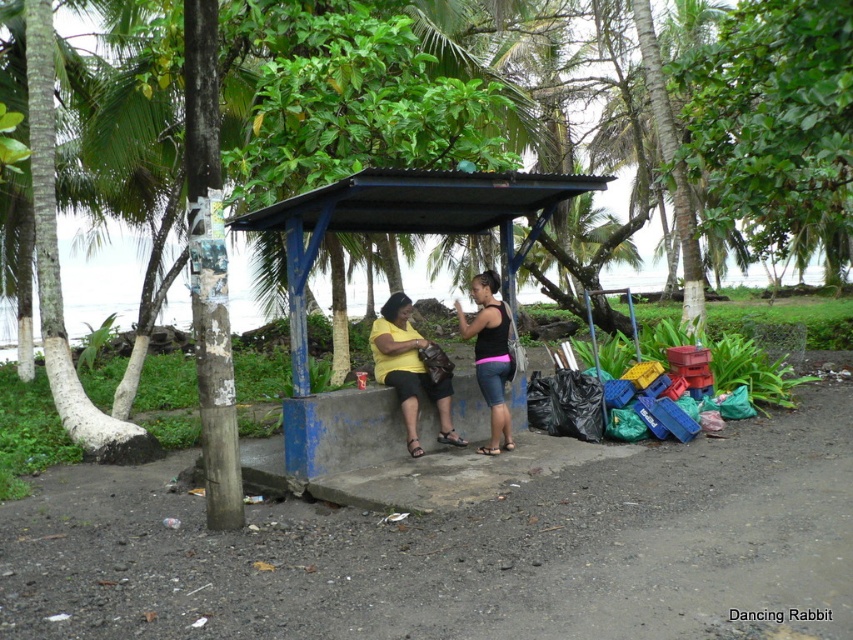
Can you confirm if white bark tree at center is positioned above blue painted wood bus stop at center?

Correct, white bark tree at center is located above blue painted wood bus stop at center.

Who is positioned more to the right, white bark tree at center or blue painted wood bus stop at center?

From the viewer's perspective, white bark tree at center appears more on the right side.

Is point (564, 204) farther from viewer compared to point (431, 200)?

Yes.

The width and height of the screenshot is (853, 640). What are the coordinates of `white bark tree at center` in the screenshot? It's located at (770, 115).

Is the position of white bark tree at center more distant than that of pink fabric shorts at center?

No.

Between white bark tree at center and pink fabric shorts at center, which one is positioned higher?

white bark tree at center

Is point (787, 138) behind point (494, 444)?

Yes, point (787, 138) is behind point (494, 444).

This screenshot has height=640, width=853. Find the location of `white bark tree at center`. white bark tree at center is located at coordinates (770, 115).

Between blue painted wood bus stop at center and yellow matte shirt at center, which one has less height?

Standing shorter between the two is yellow matte shirt at center.

Who is more distant from viewer, [498,196] or [421,337]?

The point [421,337] is behind.

Locate an element on the screen. blue painted wood bus stop at center is located at coordinates (397, 232).